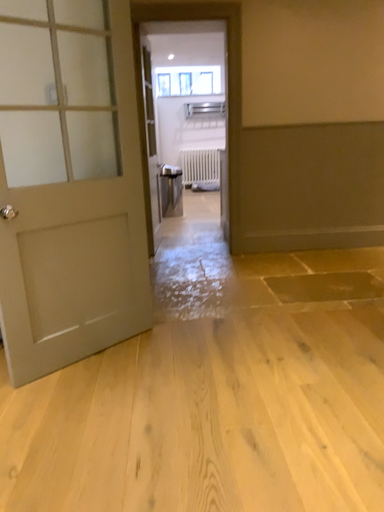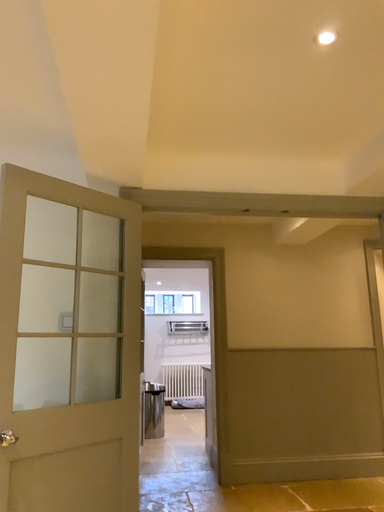
Question: How did the camera likely rotate when shooting the video?

Choices:
 (A) rotated upward
 (B) rotated downward

Answer: (A)